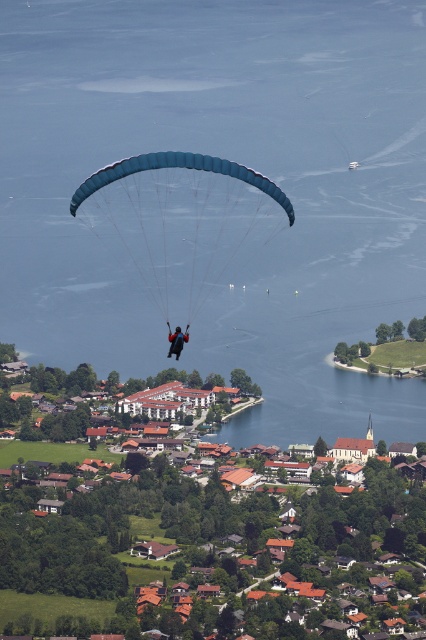
Can you confirm if brown tiled roofs at center is taller than dark blue fabric parachute at center?

Indeed, brown tiled roofs at center has a greater height compared to dark blue fabric parachute at center.

Which is below, brown tiled roofs at center or dark blue fabric parachute at center?

Positioned lower is brown tiled roofs at center.

Is point (77, 618) positioned behind point (187, 326)?

Yes, it is behind point (187, 326).

Locate an element on the screen. This screenshot has width=426, height=640. brown tiled roofs at center is located at coordinates (132, 532).

Does brown tiled roofs at center have a smaller size compared to blue fabric parachute at center?

Actually, brown tiled roofs at center might be larger than blue fabric parachute at center.

Does brown tiled roofs at center have a larger size compared to blue fabric parachute at center?

Yes, brown tiled roofs at center is bigger than blue fabric parachute at center.

Between point (69, 504) and point (238, 259), which one is positioned in front?

Positioned in front is point (238, 259).

This screenshot has height=640, width=426. Identify the location of brown tiled roofs at center. (132, 532).

Between blue water at center and brown tiled roofs at center, which one has more height?

With more height is blue water at center.

Is blue water at center bigger than brown tiled roofs at center?

Correct, blue water at center is larger in size than brown tiled roofs at center.

Where is `blue water at center`? The image size is (426, 640). blue water at center is located at coordinates (232, 160).